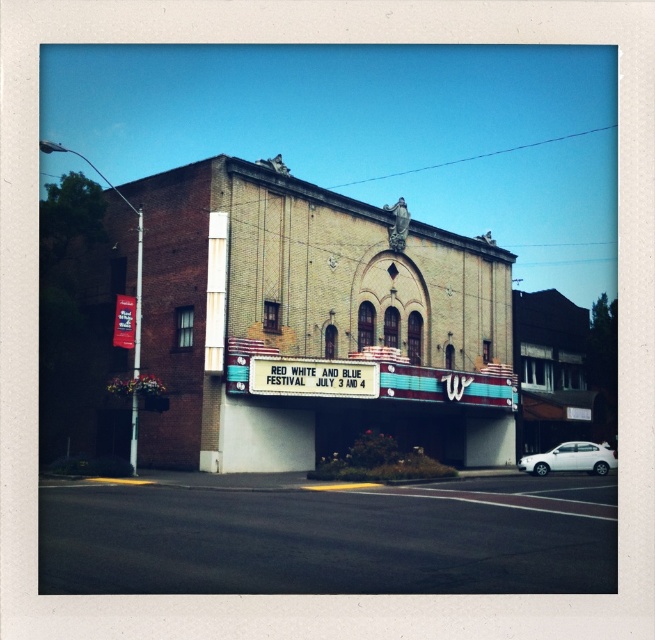
Question: Which object is positioned farthest from the white marquee at center?

Choices:
 (A) matte red sign at left
 (B) white matte car at lower right

Answer: (B)

Question: Which object appears closest to the camera in this image?

Choices:
 (A) matte red sign at left
 (B) white marquee at center
 (C) white matte car at lower right

Answer: (A)

Question: Based on their relative distances, which object is nearer to the white matte car at lower right?

Choices:
 (A) matte red sign at left
 (B) white marquee at center

Answer: (B)

Question: Does white marquee at center have a smaller size compared to white matte car at lower right?

Choices:
 (A) no
 (B) yes

Answer: (B)

Question: Is white marquee at center above matte red sign at left?

Choices:
 (A) no
 (B) yes

Answer: (A)

Question: Does white marquee at center appear on the left side of white matte car at lower right?

Choices:
 (A) no
 (B) yes

Answer: (B)